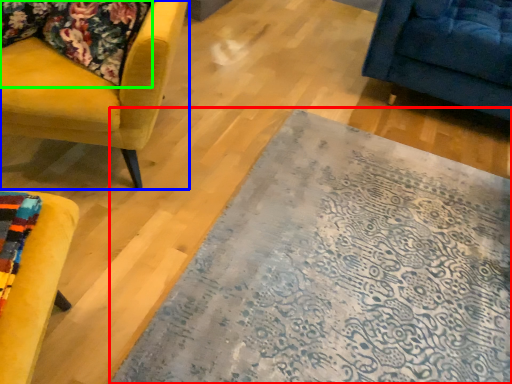
Question: Considering the real-world distances, which object is closest to mat (highlighted by a red box)? chair (highlighted by a blue box) or fabric (highlighted by a green box).

Choices:
 (A) chair
 (B) fabric

Answer: (A)